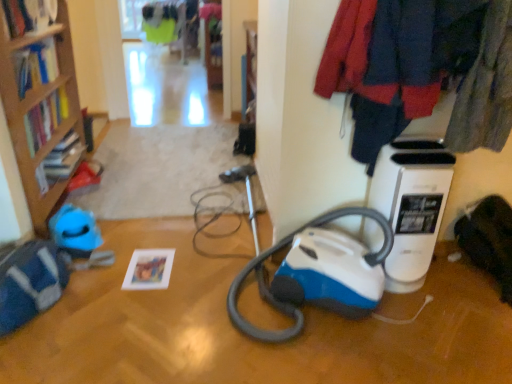
Question: Is matte paper photo frame at lower left, placed as the 3th book when sorted from left to right, located outside wooden bookcase at left?

Choices:
 (A) yes
 (B) no

Answer: (A)

Question: From a real-world perspective, does matte paper photo frame at lower left, placed as the 3th book when sorted from left to right, sit lower than wooden bookcase at left?

Choices:
 (A) yes
 (B) no

Answer: (A)

Question: Is matte paper photo frame at lower left, which is counted as the first book, starting from the bottom, thinner than wooden bookcase at left?

Choices:
 (A) no
 (B) yes

Answer: (B)

Question: Considering the relative positions of matte paper photo frame at lower left, placed as the first book when sorted from right to left, and wooden bookcase at left in the image provided, is matte paper photo frame at lower left, placed as the first book when sorted from right to left, to the right of wooden bookcase at left from the viewer's perspective?

Choices:
 (A) yes
 (B) no

Answer: (A)

Question: Can you confirm if matte paper photo frame at lower left, which is counted as the first book, starting from the bottom, is shorter than wooden bookcase at left?

Choices:
 (A) yes
 (B) no

Answer: (A)

Question: Does matte paper photo frame at lower left, placed as the first book when sorted from right to left, have a greater width compared to wooden bookcase at left?

Choices:
 (A) yes
 (B) no

Answer: (B)

Question: From the image's perspective, is hardcover book at upper left, which is counted as the third book, starting from the bottom, beneath white plastic air purifier at right?

Choices:
 (A) yes
 (B) no

Answer: (B)

Question: Is hardcover book at upper left, which is the 1th book in top-to-bottom order, next to white plastic air purifier at right and touching it?

Choices:
 (A) no
 (B) yes

Answer: (A)

Question: Considering the relative positions of hardcover book at upper left, which is counted as the third book, starting from the bottom, and white plastic air purifier at right in the image provided, is hardcover book at upper left, which is counted as the third book, starting from the bottom, to the left of white plastic air purifier at right from the viewer's perspective?

Choices:
 (A) yes
 (B) no

Answer: (A)

Question: Is hardcover book at upper left, which is counted as the third book, starting from the bottom, looking in the opposite direction of white plastic air purifier at right?

Choices:
 (A) yes
 (B) no

Answer: (B)

Question: Considering the relative sizes of hardcover book at upper left, which is the 1th book in top-to-bottom order, and white plastic air purifier at right in the image provided, is hardcover book at upper left, which is the 1th book in top-to-bottom order, bigger than white plastic air purifier at right?

Choices:
 (A) yes
 (B) no

Answer: (B)

Question: Considering the relative positions of hardcover book at upper left, which is the 1th book in top-to-bottom order, and white plastic air purifier at right in the image provided, is hardcover book at upper left, which is the 1th book in top-to-bottom order, to the right of white plastic air purifier at right from the viewer's perspective?

Choices:
 (A) no
 (B) yes

Answer: (A)

Question: Could you tell me if hardcover book at left, which ranks as the second book in right-to-left order, is facing velvet-like fabric coat at upper right?

Choices:
 (A) no
 (B) yes

Answer: (A)